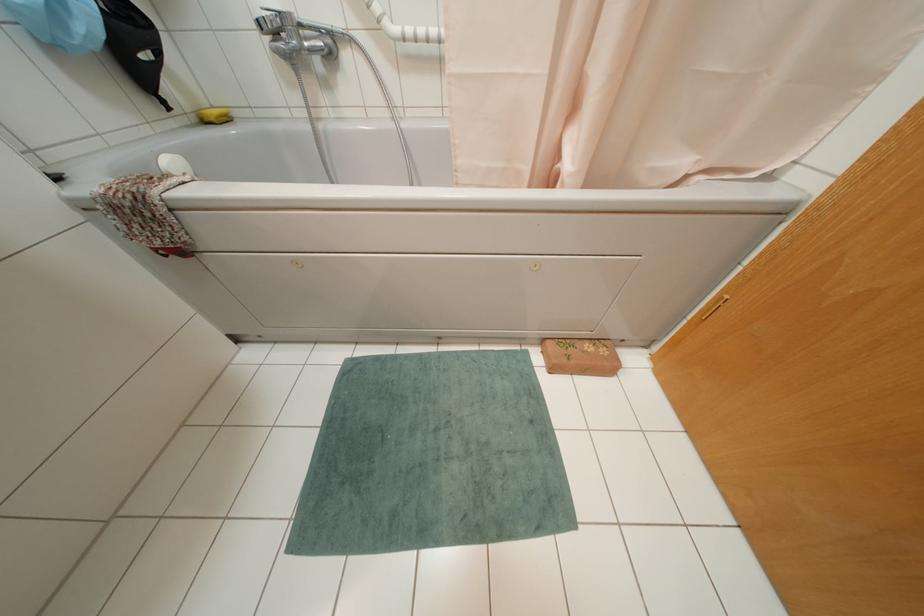
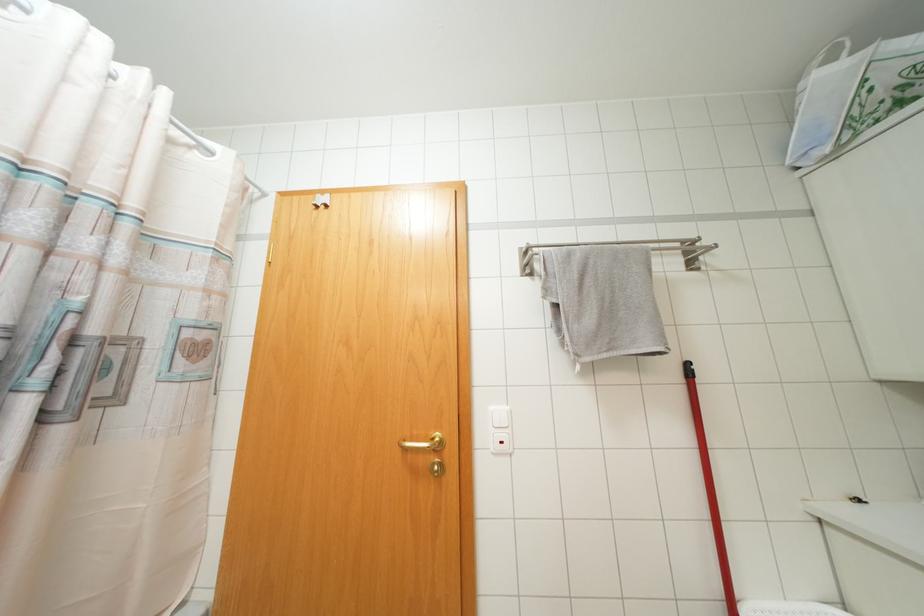
Question: The images are taken continuously from a first-person perspective. In which direction is your viewpoint rotating?

Choices:
 (A) Left
 (B) Right
 (C) Up
 (D) Down

Answer: (B)